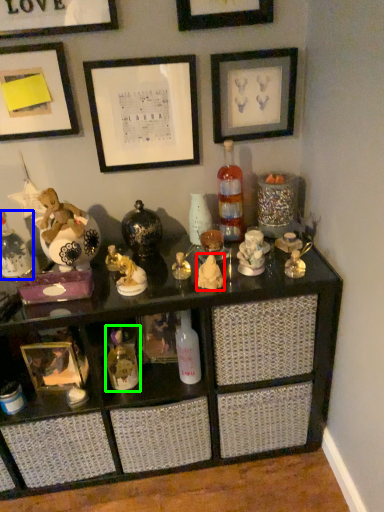
Question: Which object is positioned farthest from toy (highlighted by a red box)? Select from bottle (highlighted by a blue box) and toy (highlighted by a green box).

Choices:
 (A) bottle
 (B) toy

Answer: (A)